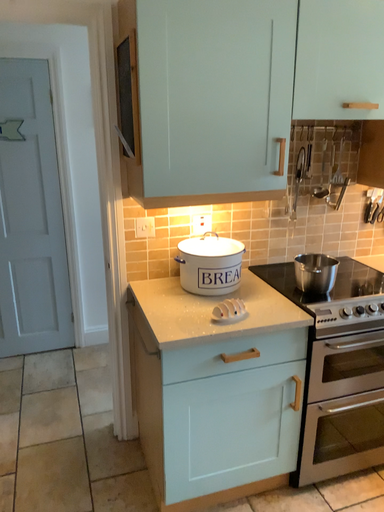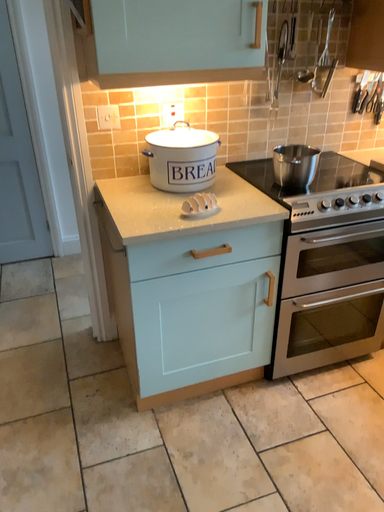
Question: Which way did the camera rotate in the video?

Choices:
 (A) rotated downward
 (B) rotated upward

Answer: (A)